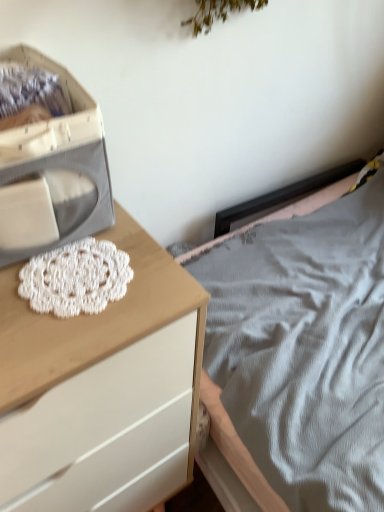
Question: Considering the relative sizes of white fabric storage box at left and white crochet doily at center-left in the image provided, is white fabric storage box at left bigger than white crochet doily at center-left?

Choices:
 (A) no
 (B) yes

Answer: (B)

Question: From the image's perspective, does white fabric storage box at left appear lower than white crochet doily at center-left?

Choices:
 (A) no
 (B) yes

Answer: (A)

Question: Considering the relative positions of white fabric storage box at left and white crochet doily at center-left in the image provided, is white fabric storage box at left to the left of white crochet doily at center-left from the viewer's perspective?

Choices:
 (A) yes
 (B) no

Answer: (A)

Question: Considering the relative sizes of white fabric storage box at left and white crochet doily at center-left in the image provided, is white fabric storage box at left shorter than white crochet doily at center-left?

Choices:
 (A) yes
 (B) no

Answer: (B)

Question: Is white fabric storage box at left to the right of white crochet doily at center-left from the viewer's perspective?

Choices:
 (A) no
 (B) yes

Answer: (A)

Question: Is white fabric storage box at left positioned far away from white crochet doily at center-left?

Choices:
 (A) no
 (B) yes

Answer: (A)

Question: Can you confirm if white wood chest of drawers at left is smaller than white crochet doily at center-left?

Choices:
 (A) no
 (B) yes

Answer: (A)

Question: Considering the relative sizes of white wood chest of drawers at left and white crochet doily at center-left in the image provided, is white wood chest of drawers at left wider than white crochet doily at center-left?

Choices:
 (A) yes
 (B) no

Answer: (A)

Question: Does white wood chest of drawers at left have a lesser height compared to white crochet doily at center-left?

Choices:
 (A) no
 (B) yes

Answer: (A)

Question: Considering the relative positions of white wood chest of drawers at left and white crochet doily at center-left in the image provided, is white wood chest of drawers at left to the left of white crochet doily at center-left from the viewer's perspective?

Choices:
 (A) no
 (B) yes

Answer: (B)

Question: Is white wood chest of drawers at left far from white crochet doily at center-left?

Choices:
 (A) yes
 (B) no

Answer: (B)

Question: From a real-world perspective, is white wood chest of drawers at left on white crochet doily at center-left?

Choices:
 (A) no
 (B) yes

Answer: (A)

Question: Would you consider white crochet doily at center-left to be distant from white wood chest of drawers at left?

Choices:
 (A) no
 (B) yes

Answer: (A)